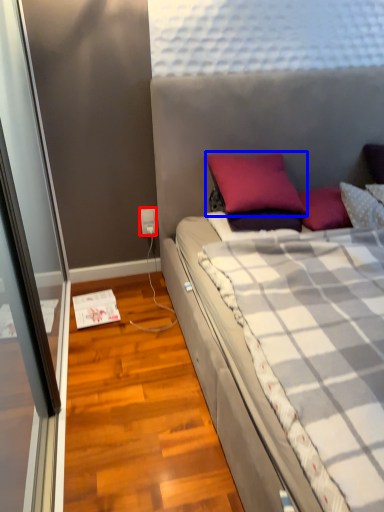
Question: Which object appears farthest to the camera in this image, power outlet (highlighted by a red box) or pillow (highlighted by a blue box)?

Choices:
 (A) power outlet
 (B) pillow

Answer: (A)